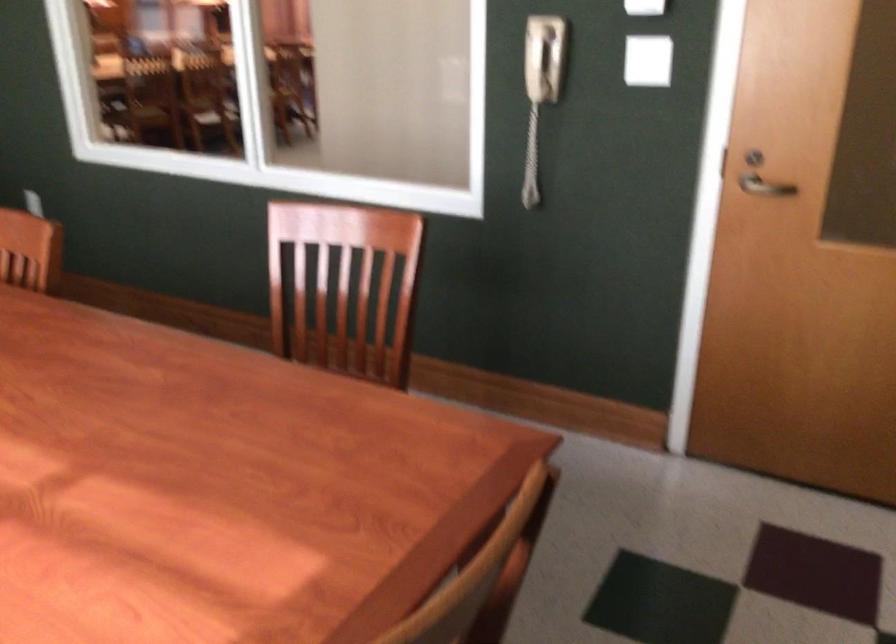
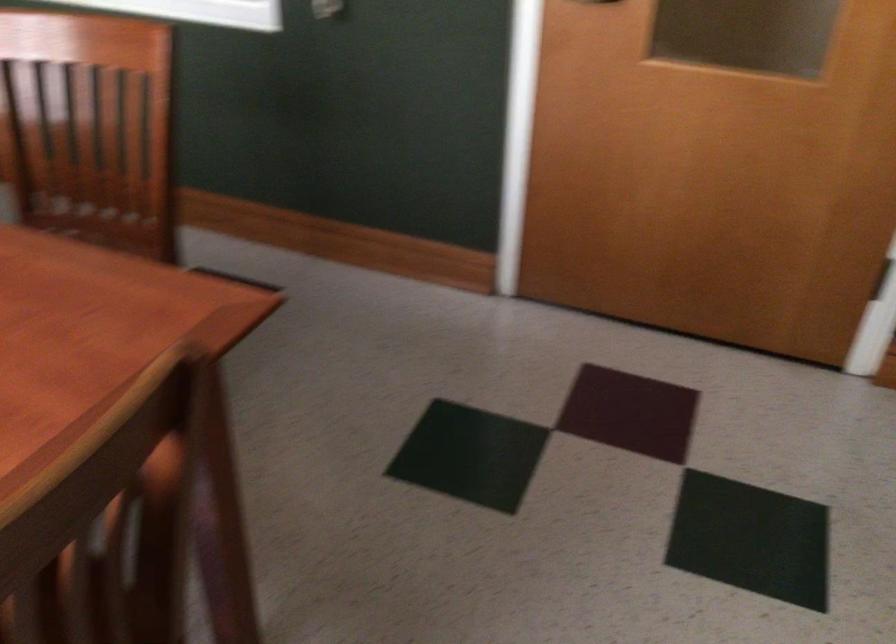
Question: How did the camera likely rotate?

Choices:
 (A) Left
 (B) Right
 (C) Up
 (D) Down

Answer: (D)